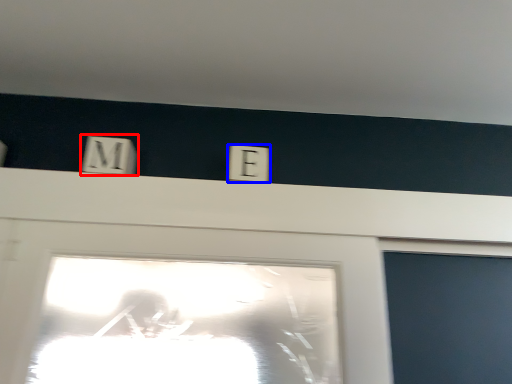
Question: Among these objects, which one is nearest to the camera, light switch (highlighted by a red box) or electric outlet (highlighted by a blue box)?

Choices:
 (A) light switch
 (B) electric outlet

Answer: (A)